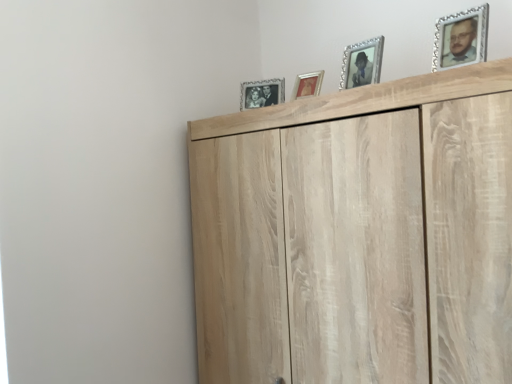
Locate an element on the screen. This screenshot has height=384, width=512. light wood cupboard at upper center is located at coordinates (358, 234).

Where is `silver/glass photo frame at upper center, the second picture frame when ordered from front to back`? Image resolution: width=512 pixels, height=384 pixels. silver/glass photo frame at upper center, the second picture frame when ordered from front to back is located at coordinates (362, 63).

Describe the element at coordinates (308, 84) in the screenshot. The height and width of the screenshot is (384, 512). I see `gold-framed picture at upper center, which ranks as the 3th picture frame in front-to-back order` at that location.

Where is `light wood cupboard at upper center`? This screenshot has width=512, height=384. light wood cupboard at upper center is located at coordinates (358, 234).

Can you confirm if light wood cupboard at upper center is thinner than silver/glass photo frame at upper center, placed as the 1th picture frame when sorted from back to front?

No, light wood cupboard at upper center is not thinner than silver/glass photo frame at upper center, placed as the 1th picture frame when sorted from back to front.

Where is `the 2nd picture frame positioned above the light wood cupboard at upper center (from a real-world perspective)`? the 2nd picture frame positioned above the light wood cupboard at upper center (from a real-world perspective) is located at coordinates (262, 93).

From the image's perspective, does light wood cupboard at upper center appear lower than silver/glass photo frame at upper center, which is the fourth picture frame in front-to-back order?

Correct, light wood cupboard at upper center appears lower than silver/glass photo frame at upper center, which is the fourth picture frame in front-to-back order, in the image.

Which of these two, light wood cupboard at upper center or silver/glass photo frame at upper center, which is the fourth picture frame in front-to-back order, stands taller?

With more height is light wood cupboard at upper center.

Is silver/glass picture frame at upper right, marked as the fourth picture frame in a back-to-front arrangement, closer to the viewer compared to silver/glass photo frame at upper center, the third picture frame positioned from the back?

Yes.

Considering the relative positions of silver/glass picture frame at upper right, marked as the fourth picture frame in a back-to-front arrangement, and silver/glass photo frame at upper center, which is the second picture frame from right to left, in the image provided, is silver/glass picture frame at upper right, marked as the fourth picture frame in a back-to-front arrangement, to the right of silver/glass photo frame at upper center, which is the second picture frame from right to left, from the viewer's perspective?

Yes, silver/glass picture frame at upper right, marked as the fourth picture frame in a back-to-front arrangement, is to the right of silver/glass photo frame at upper center, which is the second picture frame from right to left.

Would you say silver/glass photo frame at upper center, which is the second picture frame from right to left, is part of silver/glass picture frame at upper right, marked as the fourth picture frame in a back-to-front arrangement,'s contents?

No, silver/glass photo frame at upper center, which is the second picture frame from right to left, is not a part of silver/glass picture frame at upper right, marked as the fourth picture frame in a back-to-front arrangement.

Is silver/glass picture frame at upper right, acting as the 1th picture frame starting from the right, placed right next to silver/glass photo frame at upper center, which is the fourth picture frame in front-to-back order?

No, silver/glass picture frame at upper right, acting as the 1th picture frame starting from the right, is not with silver/glass photo frame at upper center, which is the fourth picture frame in front-to-back order.

From the silver/glass photo frame at upper center, which is the fourth picture frame in front-to-back order, count 3rd picture frame to the right and point to it. Please provide its 2D coordinates.

[(461, 38)]

How different are the orientations of silver/glass picture frame at upper right, marked as the 1th picture frame in a front-to-back arrangement, and silver/glass photo frame at upper center, which is the fourth picture frame in front-to-back order, in degrees?

4.84 degrees.

In the scene shown: Relative to silver/glass photo frame at upper center, placed as the 1th picture frame when sorted from back to front, is silver/glass picture frame at upper right, acting as the 1th picture frame starting from the right, in front or behind?

silver/glass picture frame at upper right, acting as the 1th picture frame starting from the right, is positioned closer to the viewer than silver/glass photo frame at upper center, placed as the 1th picture frame when sorted from back to front.

What's the angular difference between silver/glass photo frame at upper center, which is the second picture frame from right to left, and gold-framed picture at upper center, the 2th picture frame positioned from the left,'s facing directions?

The facing directions of silver/glass photo frame at upper center, which is the second picture frame from right to left, and gold-framed picture at upper center, the 2th picture frame positioned from the left, are 3.84 degrees apart.

Is silver/glass photo frame at upper center, which is counted as the third picture frame, starting from the left, smaller than gold-framed picture at upper center, the 2th picture frame positioned from the left?

Actually, silver/glass photo frame at upper center, which is counted as the third picture frame, starting from the left, might be larger than gold-framed picture at upper center, the 2th picture frame positioned from the left.

Would you say silver/glass photo frame at upper center, the third picture frame positioned from the back, is inside or outside gold-framed picture at upper center, placed as the 3th picture frame when sorted from right to left?

silver/glass photo frame at upper center, the third picture frame positioned from the back, exists outside the volume of gold-framed picture at upper center, placed as the 3th picture frame when sorted from right to left.

Is silver/glass photo frame at upper center, the second picture frame when ordered from front to back, positioned with its back to gold-framed picture at upper center, which ranks as the 3th picture frame in front-to-back order?

No, silver/glass photo frame at upper center, the second picture frame when ordered from front to back, is not facing away from gold-framed picture at upper center, which ranks as the 3th picture frame in front-to-back order.

Between silver/glass photo frame at upper center, which is the second picture frame from right to left, and silver/glass picture frame at upper right, which is the 4th picture frame in left-to-right order, which one has less height?

Standing shorter between the two is silver/glass picture frame at upper right, which is the 4th picture frame in left-to-right order.

From a real-world perspective, is silver/glass photo frame at upper center, the second picture frame when ordered from front to back, above or below silver/glass picture frame at upper right, marked as the fourth picture frame in a back-to-front arrangement?

silver/glass photo frame at upper center, the second picture frame when ordered from front to back, is situated lower than silver/glass picture frame at upper right, marked as the fourth picture frame in a back-to-front arrangement, in the real world.

Is silver/glass photo frame at upper center, which is counted as the third picture frame, starting from the left, inside or outside of silver/glass picture frame at upper right, which is the 4th picture frame in left-to-right order?

silver/glass photo frame at upper center, which is counted as the third picture frame, starting from the left, is located beyond the bounds of silver/glass picture frame at upper right, which is the 4th picture frame in left-to-right order.

Where is `picture frame in front of the silver/glass photo frame at upper center, which is the second picture frame from right to left`? This screenshot has height=384, width=512. picture frame in front of the silver/glass photo frame at upper center, which is the second picture frame from right to left is located at coordinates (461, 38).

Is the position of silver/glass photo frame at upper center, which is the second picture frame from right to left, less distant than that of light wood cupboard at upper center?

No, the depth of silver/glass photo frame at upper center, which is the second picture frame from right to left, is greater than that of light wood cupboard at upper center.

Does silver/glass photo frame at upper center, the second picture frame when ordered from front to back, turn towards light wood cupboard at upper center?

No.

How distant is silver/glass photo frame at upper center, which is the second picture frame from right to left, from light wood cupboard at upper center?

46.73 centimeters.

Does silver/glass photo frame at upper center, which is counted as the third picture frame, starting from the left, appear on the left side of light wood cupboard at upper center?

Indeed, silver/glass photo frame at upper center, which is counted as the third picture frame, starting from the left, is positioned on the left side of light wood cupboard at upper center.

Is light wood cupboard at upper center oriented away from silver/glass photo frame at upper center, the third picture frame positioned from the back?

No, silver/glass photo frame at upper center, the third picture frame positioned from the back, is not at the back of light wood cupboard at upper center.

Consider the image. Can we say light wood cupboard at upper center lies outside silver/glass photo frame at upper center, which is counted as the third picture frame, starting from the left?

Yes, light wood cupboard at upper center is outside of silver/glass photo frame at upper center, which is counted as the third picture frame, starting from the left.

Considering the relative positions of light wood cupboard at upper center and silver/glass photo frame at upper center, the second picture frame when ordered from front to back, in the image provided, is light wood cupboard at upper center behind silver/glass photo frame at upper center, the second picture frame when ordered from front to back,?

No, the depth of light wood cupboard at upper center is less than that of silver/glass photo frame at upper center, the second picture frame when ordered from front to back.

At what (x,y) coordinates should I click in order to perform the action: click on picture frame that is the 4th object located behind the light wood cupboard at upper center. Please return your answer as a coordinate pair (x, y). This screenshot has height=384, width=512. Looking at the image, I should click on (262, 93).

The width and height of the screenshot is (512, 384). I want to click on the 1st picture frame to the left of the silver/glass picture frame at upper right, marked as the fourth picture frame in a back-to-front arrangement, counting from the anchor's position, so click(x=362, y=63).

Which object lies further to the anchor point silver/glass picture frame at upper right, acting as the 1th picture frame starting from the right, gold-framed picture at upper center, acting as the 2th picture frame starting from the back, or light wood cupboard at upper center?

Among the two, gold-framed picture at upper center, acting as the 2th picture frame starting from the back, is located further to silver/glass picture frame at upper right, acting as the 1th picture frame starting from the right.

Based on their spatial positions, is light wood cupboard at upper center or silver/glass photo frame at upper center, the second picture frame when ordered from front to back, closer to silver/glass picture frame at upper right, marked as the fourth picture frame in a back-to-front arrangement?

silver/glass photo frame at upper center, the second picture frame when ordered from front to back, lies closer to silver/glass picture frame at upper right, marked as the fourth picture frame in a back-to-front arrangement, than the other object.

Looking at this image, looking at the image, which one is located further to silver/glass photo frame at upper center, the third picture frame positioned from the back, light wood cupboard at upper center or gold-framed picture at upper center, which ranks as the 3th picture frame in front-to-back order?

Among the two, light wood cupboard at upper center is located further to silver/glass photo frame at upper center, the third picture frame positioned from the back.

In the scene shown: Looking at the image, which one is located closer to silver/glass photo frame at upper center, which is counted as the third picture frame, starting from the left, silver/glass photo frame at upper center, placed as the 1th picture frame when sorted from back to front, or light wood cupboard at upper center?

Based on the image, silver/glass photo frame at upper center, placed as the 1th picture frame when sorted from back to front, appears to be nearer to silver/glass photo frame at upper center, which is counted as the third picture frame, starting from the left.

Looking at the image, which one is located further to silver/glass photo frame at upper center, which is the second picture frame from right to left, silver/glass picture frame at upper right, marked as the 1th picture frame in a front-to-back arrangement, or light wood cupboard at upper center?

light wood cupboard at upper center lies further to silver/glass photo frame at upper center, which is the second picture frame from right to left, than the other object.

Which object lies nearer to the anchor point silver/glass photo frame at upper center, placed as the 1th picture frame when sorted from back to front, silver/glass photo frame at upper center, which is counted as the third picture frame, starting from the left, or gold-framed picture at upper center, acting as the 2th picture frame starting from the back?

Based on the image, gold-framed picture at upper center, acting as the 2th picture frame starting from the back, appears to be nearer to silver/glass photo frame at upper center, placed as the 1th picture frame when sorted from back to front.

Looking at the image, which one is located closer to silver/glass photo frame at upper center, which is the fourth picture frame in front-to-back order, gold-framed picture at upper center, the 2th picture frame positioned from the left, or silver/glass photo frame at upper center, the third picture frame positioned from the back?

gold-framed picture at upper center, the 2th picture frame positioned from the left.

When comparing their distances from gold-framed picture at upper center, placed as the 3th picture frame when sorted from right to left, does silver/glass photo frame at upper center, the third picture frame positioned from the back, or silver/glass picture frame at upper right, acting as the 1th picture frame starting from the right, seem further?

Based on the image, silver/glass picture frame at upper right, acting as the 1th picture frame starting from the right, appears to be further to gold-framed picture at upper center, placed as the 3th picture frame when sorted from right to left.

Find the location of a particular element. picture frame situated between silver/glass photo frame at upper center, which appears as the first picture frame when viewed from the left, and silver/glass photo frame at upper center, the third picture frame positioned from the back, from left to right is located at coordinates (308, 84).

You are a GUI agent. You are given a task and a screenshot of the screen. Output one action in this format:
    pyautogui.click(x=<x>, y=<y>)
    Task: Click on the picture frame between silver/glass photo frame at upper center, which is the fourth picture frame in front-to-back order, and light wood cupboard at upper center from top to bottom
    This screenshot has width=512, height=384.
    Given the screenshot: What is the action you would take?
    pyautogui.click(x=308, y=84)

Image resolution: width=512 pixels, height=384 pixels. I want to click on picture frame between silver/glass picture frame at upper right, marked as the fourth picture frame in a back-to-front arrangement, and gold-framed picture at upper center, placed as the 3th picture frame when sorted from right to left, in the front-back direction, so click(x=362, y=63).